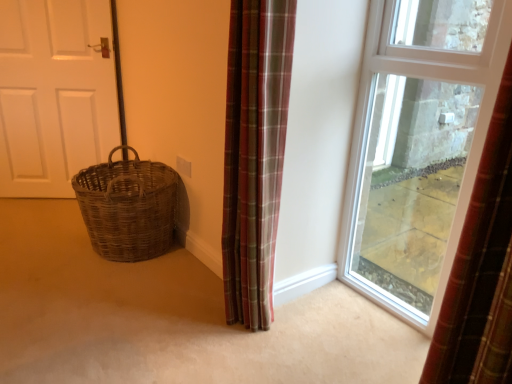
This screenshot has width=512, height=384. What do you see at coordinates (170, 318) in the screenshot? I see `woven wicker basket at left` at bounding box center [170, 318].

Describe the element at coordinates (54, 94) in the screenshot. I see `white matte door at left` at that location.

At what (x,y) coordinates should I click in order to perform the action: click on woven brown basket at lower left. Please return your answer as a coordinate pair (x, y). The height and width of the screenshot is (384, 512). Looking at the image, I should click on (128, 207).

You are a GUI agent. You are given a task and a screenshot of the screen. Output one action in this format:
    pyautogui.click(x=<x>, y=<y>)
    Task: Click on the woven wicker basket at left
    
    Given the screenshot: What is the action you would take?
    pyautogui.click(x=170, y=318)

Consider the image. Is clear glass window at center facing away from plaid fabric curtain at center?

clear glass window at center does not have its back to plaid fabric curtain at center.

How distant is clear glass window at center from plaid fabric curtain at center?

37.65 inches.

Does clear glass window at center have a lesser height compared to plaid fabric curtain at center?

No, clear glass window at center is not shorter than plaid fabric curtain at center.

Is point (464, 106) positioned in front of point (247, 166)?

No, (464, 106) is further to viewer.

From a real-world perspective, does white matte door at left sit lower than clear glass window at center?

Correct, in the physical world, white matte door at left is lower than clear glass window at center.

This screenshot has width=512, height=384. In the image, there is a clear glass window at center. What are the coordinates of `door below it (from a real-world perspective)` in the screenshot? It's located at (54, 94).

Could you tell me if white matte door at left is facing clear glass window at center?

No, white matte door at left is not aimed at clear glass window at center.

Where is `corridor below the plaid fabric curtain at center (from the image's perspective)`? The width and height of the screenshot is (512, 384). corridor below the plaid fabric curtain at center (from the image's perspective) is located at coordinates (170, 318).

From the picture: How many degrees apart are the facing directions of woven wicker basket at left and plaid fabric curtain at center?

88.7 degrees.

Considering the sizes of objects woven wicker basket at left and plaid fabric curtain at center in the image provided, who is shorter, woven wicker basket at left or plaid fabric curtain at center?

With less height is woven wicker basket at left.

Are woven brown basket at lower left and white matte door at left located far from each other?

woven brown basket at lower left is near white matte door at left, not far away.

Choose the correct answer: Is woven brown basket at lower left inside white matte door at left or outside it?

woven brown basket at lower left is not enclosed by white matte door at left.

From the picture: Is white matte door at left at the back of woven brown basket at lower left?

woven brown basket at lower left does not have its back to white matte door at left.

Is woven brown basket at lower left wider or thinner than white matte door at left?

woven brown basket at lower left is wider than white matte door at left.

Are white matte door at left and woven wicker basket at left located far from each other?

Yes, white matte door at left and woven wicker basket at left are located far from each other.

From the picture: In terms of width, does white matte door at left look wider or thinner when compared to woven wicker basket at left?

white matte door at left is thinner than woven wicker basket at left.

From a real-world perspective, relative to woven wicker basket at left, is white matte door at left vertically above or below?

In terms of real-world spatial position, white matte door at left is above woven wicker basket at left.

Does white matte door at left appear on the right side of woven wicker basket at left?

No, white matte door at left is not to the right of woven wicker basket at left.

In the scene shown: Between woven brown basket at lower left and woven wicker basket at left, which one has more height?

Result: woven brown basket at lower left.

In the scene shown: Is woven brown basket at lower left facing away from woven wicker basket at left?

That's not correct — woven brown basket at lower left is not looking away from woven wicker basket at left.

From a real-world perspective, is woven brown basket at lower left positioned under woven wicker basket at left based on gravity?

Incorrect, from a real-world perspective, woven brown basket at lower left is higher than woven wicker basket at left.

Is woven brown basket at lower left located outside woven wicker basket at left?

That's correct, woven brown basket at lower left is outside of woven wicker basket at left.

Locate an element on the screen. This screenshot has width=512, height=384. door above the woven wicker basket at left (from a real-world perspective) is located at coordinates (54, 94).

Is woven wicker basket at left oriented towards white matte door at left?

No.

Between woven wicker basket at left and white matte door at left, which one has less height?

Standing shorter between the two is woven wicker basket at left.

Is woven wicker basket at left positioned beyond the bounds of white matte door at left?

Yes.

Find the location of a particular element. window that is above the plaid fabric curtain at center (from the image's perspective) is located at coordinates (418, 146).

Find the location of a particular element. Image resolution: width=512 pixels, height=384 pixels. window above the white matte door at left (from a real-world perspective) is located at coordinates (418, 146).

Which object lies further to the anchor point woven wicker basket at left, plaid fabric curtain at center or woven brown basket at lower left?

Based on the image, plaid fabric curtain at center appears to be further to woven wicker basket at left.

Looking at the image, which one is located further to clear glass window at center, woven brown basket at lower left or plaid fabric curtain at center?

woven brown basket at lower left is positioned further to the anchor clear glass window at center.

Which object lies nearer to the anchor point woven wicker basket at left, woven brown basket at lower left or plaid fabric curtain at center?

woven brown basket at lower left is positioned closer to the anchor woven wicker basket at left.

Estimate the real-world distances between objects in this image. Which object is closer to white matte door at left, woven wicker basket at left or plaid fabric curtain at center?

The object closer to white matte door at left is woven wicker basket at left.

Which object lies nearer to the anchor point woven brown basket at lower left, plaid fabric curtain at center or woven wicker basket at left?

woven wicker basket at left.

From the image, which object appears to be nearer to white matte door at left, woven brown basket at lower left or plaid fabric curtain at center?

woven brown basket at lower left.

From the picture: Considering their positions, is clear glass window at center positioned closer to plaid fabric curtain at center than white matte door at left?

clear glass window at center is closer to plaid fabric curtain at center.

Looking at the image, which one is located further to woven wicker basket at left, white matte door at left or woven brown basket at lower left?

The object further to woven wicker basket at left is white matte door at left.

Locate an element on the screen. curtain situated between woven wicker basket at left and clear glass window at center from left to right is located at coordinates (255, 153).

Locate an element on the screen. The width and height of the screenshot is (512, 384). curtain located between woven brown basket at lower left and clear glass window at center in the left-right direction is located at coordinates (255, 153).

I want to click on corridor between woven brown basket at lower left and clear glass window at center in the horizontal direction, so click(x=170, y=318).

I want to click on basket between woven wicker basket at left and white matte door at left along the z-axis, so click(128, 207).